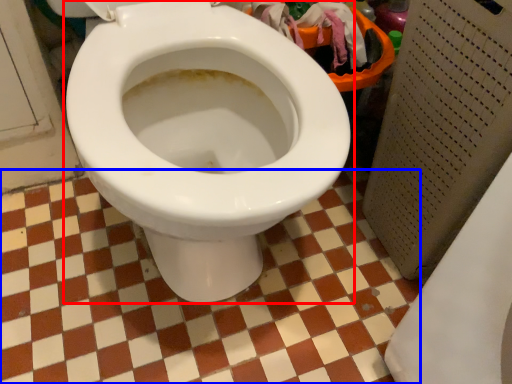
Question: Among these objects, which one is farthest to the camera, toilet (highlighted by a red box) or ceramic tile (highlighted by a blue box)?

Choices:
 (A) toilet
 (B) ceramic tile

Answer: (B)